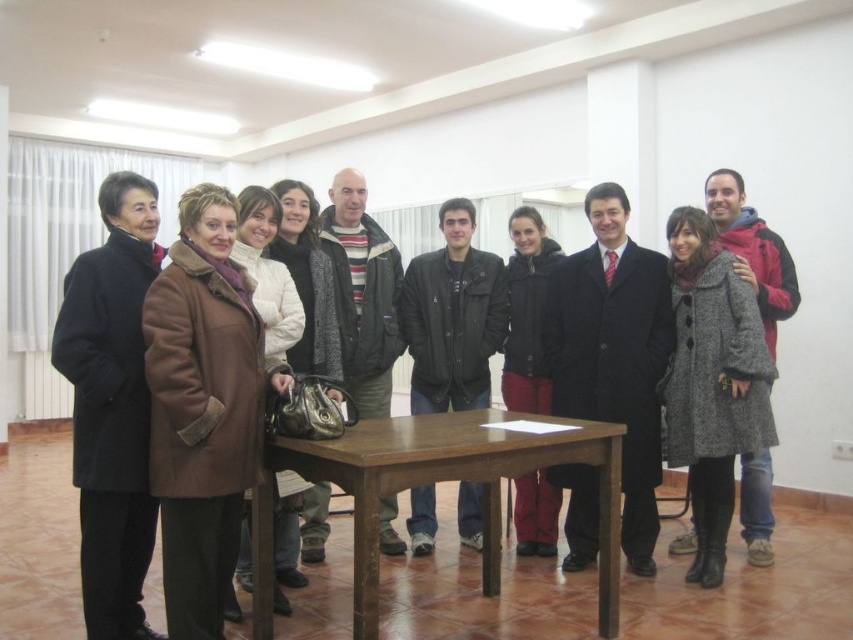
Question: Observing the image, what is the correct spatial positioning of dark gray leather jacket at center in reference to dark gray jacket at center?

Choices:
 (A) right
 (B) left

Answer: (B)

Question: Is black wool coat at left closer to the viewer compared to brown fuzzy coat at center?

Choices:
 (A) yes
 (B) no

Answer: (A)

Question: Among these points, which one is nearest to the camera?

Choices:
 (A) (82, 385)
 (B) (363, 412)
 (C) (579, 506)
 (D) (456, 291)

Answer: (A)

Question: Which of the following is the closest to the observer?

Choices:
 (A) gray wool coat at center
 (B) matte black coat at center
 (C) black wool coat at left

Answer: (C)

Question: Is matte black coat at center below gray wool coat at center?

Choices:
 (A) no
 (B) yes

Answer: (A)

Question: Which point appears farthest from the camera in this image?

Choices:
 (A) (199, 580)
 (B) (366, 193)

Answer: (B)